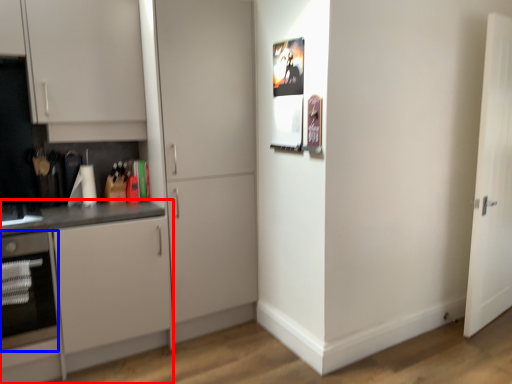
Question: Which point is closer to the camera, cabinetry (highlighted by a red box) or oven (highlighted by a blue box)?

Choices:
 (A) cabinetry
 (B) oven

Answer: (A)